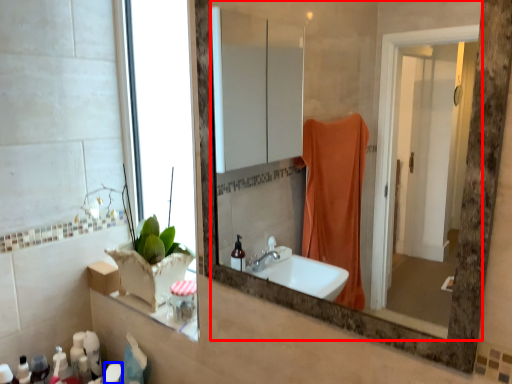
Question: Among these objects, which one is farthest to the camera, mirror (highlighted by a red box) or toiletry (highlighted by a blue box)?

Choices:
 (A) mirror
 (B) toiletry

Answer: (B)